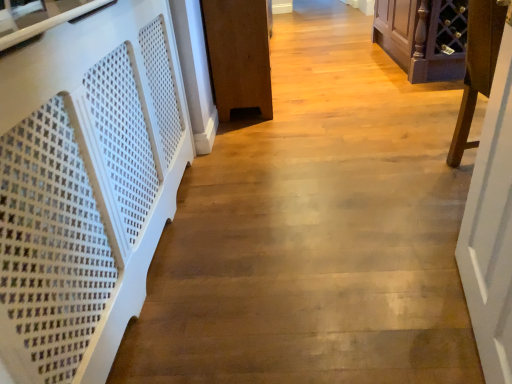
Question: Can you confirm if white wooden door at right is smaller than purple wood wine rack at right, marked as the 2th furniture in a right-to-left arrangement?

Choices:
 (A) yes
 (B) no

Answer: (A)

Question: Is white wooden door at right taller than purple wood wine rack at right, which appears as the 2th furniture when viewed from the left?

Choices:
 (A) yes
 (B) no

Answer: (A)

Question: Is white wooden door at right facing towards purple wood wine rack at right, marked as the 2th furniture in a right-to-left arrangement?

Choices:
 (A) no
 (B) yes

Answer: (A)

Question: Does white wooden door at right have a greater width compared to purple wood wine rack at right, marked as the 2th furniture in a right-to-left arrangement?

Choices:
 (A) yes
 (B) no

Answer: (B)

Question: Considering the relative positions of white wooden door at right and purple wood wine rack at right, marked as the 2th furniture in a right-to-left arrangement, in the image provided, is white wooden door at right in front of purple wood wine rack at right, marked as the 2th furniture in a right-to-left arrangement,?

Choices:
 (A) yes
 (B) no

Answer: (A)

Question: Does white wooden door at right have a larger size compared to purple wood wine rack at right, which appears as the 2th furniture when viewed from the left?

Choices:
 (A) yes
 (B) no

Answer: (B)

Question: Is brown wood cabinet at center, the 3th furniture viewed from the right, closer to camera compared to white wooden door at right?

Choices:
 (A) yes
 (B) no

Answer: (B)

Question: Is brown wood cabinet at center, the 3th furniture viewed from the right, oriented away from white wooden door at right?

Choices:
 (A) yes
 (B) no

Answer: (B)

Question: Does brown wood cabinet at center, the 3th furniture viewed from the right, lie behind white wooden door at right?

Choices:
 (A) no
 (B) yes

Answer: (B)

Question: Is brown wood cabinet at center, which is the 1th furniture from left to right, thinner than white wooden door at right?

Choices:
 (A) no
 (B) yes

Answer: (A)

Question: Is brown wood cabinet at center, which is the 1th furniture from left to right, bigger than white wooden door at right?

Choices:
 (A) no
 (B) yes

Answer: (B)

Question: Considering the relative sizes of brown wood cabinet at center, which is the 1th furniture from left to right, and white wooden door at right in the image provided, is brown wood cabinet at center, which is the 1th furniture from left to right, taller than white wooden door at right?

Choices:
 (A) no
 (B) yes

Answer: (A)

Question: From a real-world perspective, is purple wood wine rack at right, which appears as the 2th furniture when viewed from the left, beneath white perforated panel at left?

Choices:
 (A) no
 (B) yes

Answer: (A)